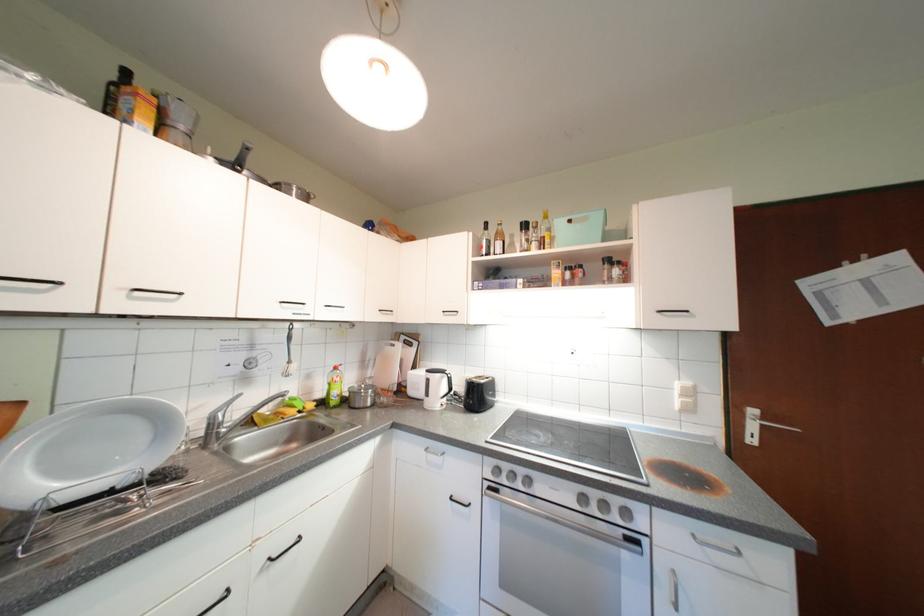
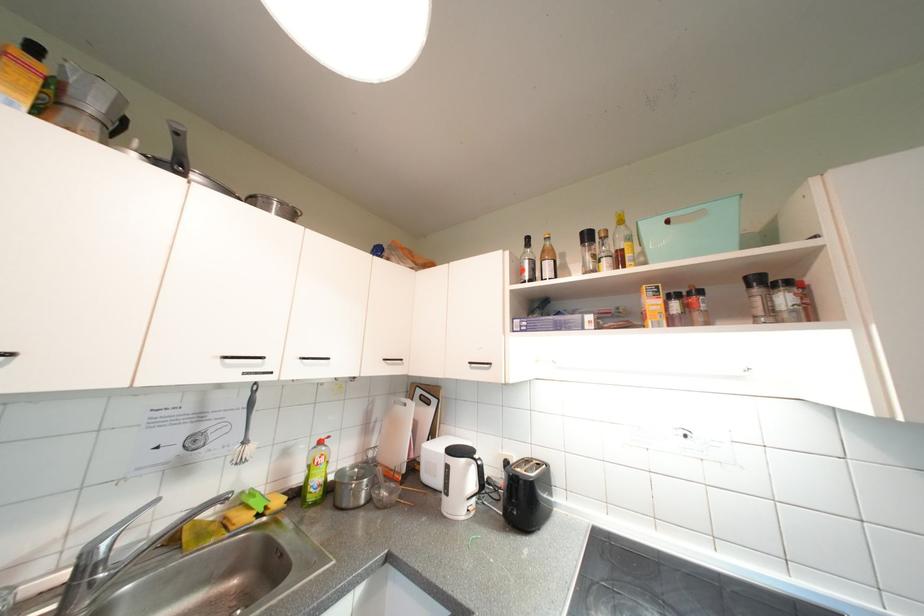
Question: The images are taken continuously from a first-person perspective. In which direction is your viewpoint rotating?

Choices:
 (A) Left
 (B) Right
 (C) Up
 (D) Down

Answer: (C)